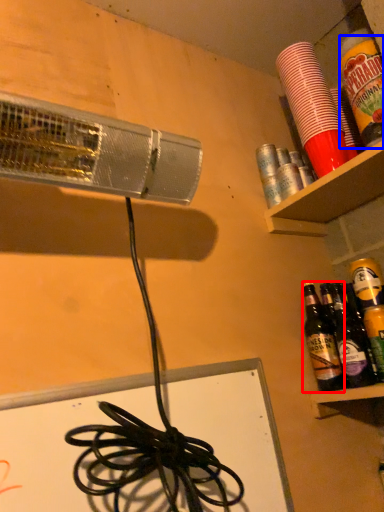
Question: Which of the following is the farthest to the observer, bottle (highlighted by a red box) or beverage (highlighted by a blue box)?

Choices:
 (A) bottle
 (B) beverage

Answer: (A)